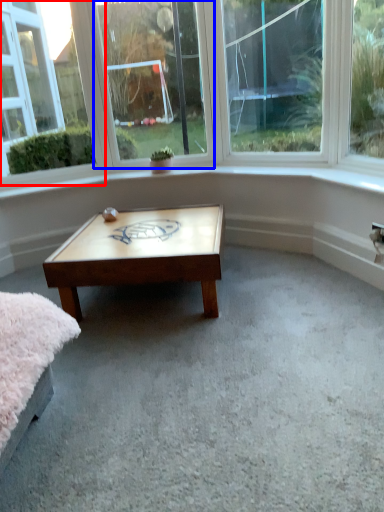
Question: Which point is further to the camera, window (highlighted by a red box) or window (highlighted by a blue box)?

Choices:
 (A) window
 (B) window

Answer: (B)